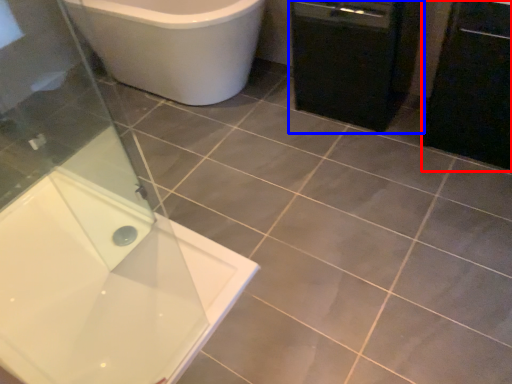
Question: Among these objects, which one is farthest to the camera, cabinetry (highlighted by a red box) or dish washer (highlighted by a blue box)?

Choices:
 (A) cabinetry
 (B) dish washer

Answer: (B)